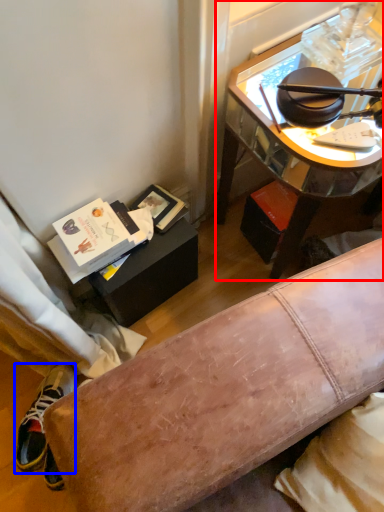
Question: Which object appears closest to the camera in this image, desk (highlighted by a red box) or shoe (highlighted by a blue box)?

Choices:
 (A) desk
 (B) shoe

Answer: (A)